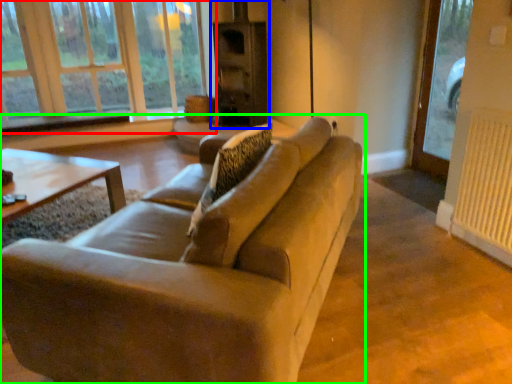
Question: Based on their relative distances, which object is farther from window (highlighted by a red box)? Choose from fireplace (highlighted by a blue box) and studio couch (highlighted by a green box).

Choices:
 (A) fireplace
 (B) studio couch

Answer: (B)